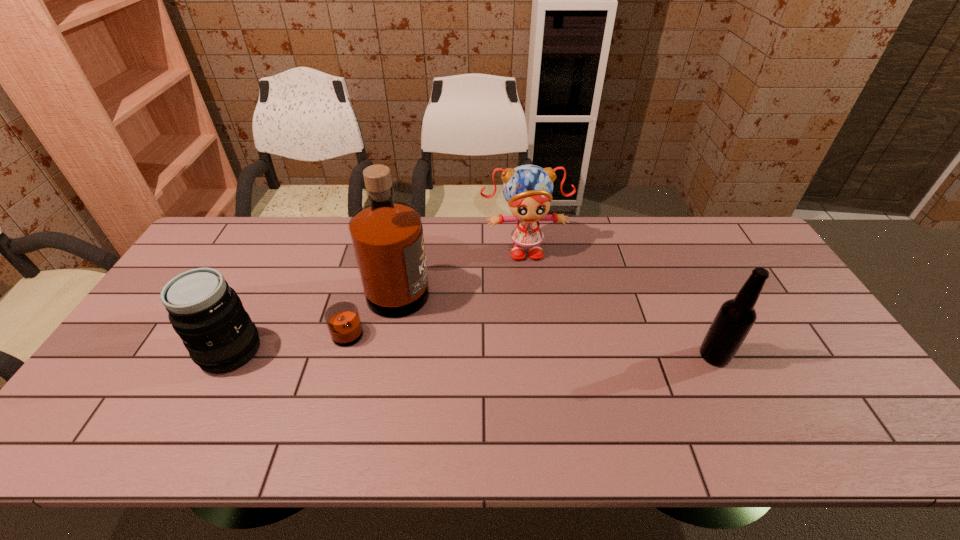
Find the location of `free space on the desktop that is between the leftmost object and the beer bottle and is positioned on the front label of the tallest object`. free space on the desktop that is between the leftmost object and the beer bottle and is positioned on the front label of the tallest object is located at coordinates (477, 354).

Locate an element on the screen. The image size is (960, 540). free space on the desktop that is between the telephoto lens and the beer bottle and is positioned on the face of the farthest object is located at coordinates (543, 354).